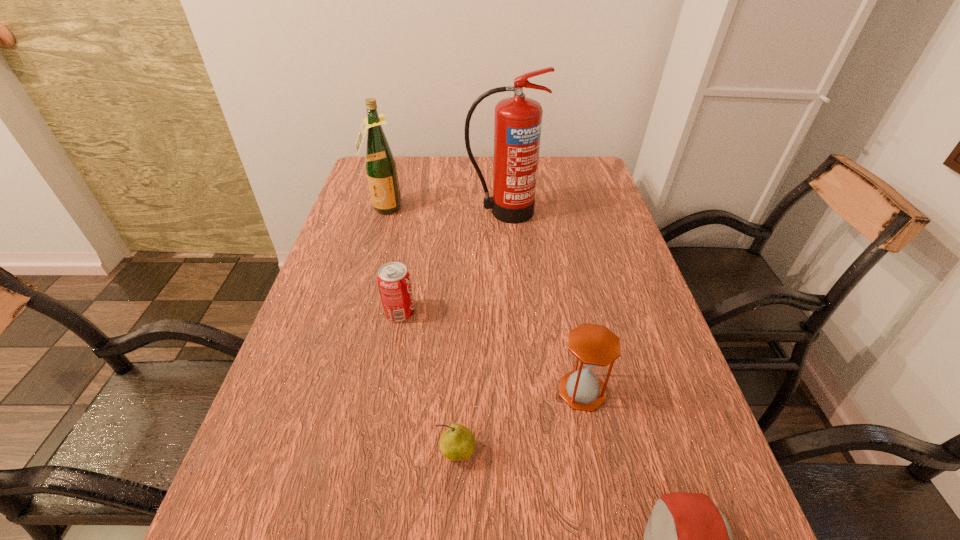
In order to click on fire extinguisher in this screenshot , I will do `click(517, 122)`.

Locate an element on the screen. This screenshot has height=540, width=960. the leftmost object is located at coordinates (380, 164).

You are a GUI agent. You are given a task and a screenshot of the screen. Output one action in this format:
    pyautogui.click(x=<x>, y=<y>)
    Task: Click on the second tallest object
    
    Given the screenshot: What is the action you would take?
    pyautogui.click(x=380, y=164)

Locate an element on the screen. The height and width of the screenshot is (540, 960). the fourth farthest object is located at coordinates (594, 345).

You are a GUI agent. You are given a task and a screenshot of the screen. Output one action in this format:
    pyautogui.click(x=<x>, y=<y>)
    Task: Click on the soda can
    The image size is (960, 540).
    Given the screenshot: What is the action you would take?
    pyautogui.click(x=394, y=282)

The height and width of the screenshot is (540, 960). I want to click on the third shortest object, so click(394, 282).

At what (x,y) coordinates should I click in order to perform the action: click on pear. Please return your answer as a coordinate pair (x, y). Looking at the image, I should click on (457, 443).

Find the location of a particular element. The height and width of the screenshot is (540, 960). the fifth tallest object is located at coordinates (457, 443).

Locate an element on the screen. vacant space located on the surface of the fire extinguisher is located at coordinates (509, 300).

You are a GUI agent. You are given a task and a screenshot of the screen. Output one action in this format:
    pyautogui.click(x=<x>, y=<y>)
    Task: Click on the free location located 0.160m on the front-facing side of the liquor
    
    Given the screenshot: What is the action you would take?
    pyautogui.click(x=372, y=251)